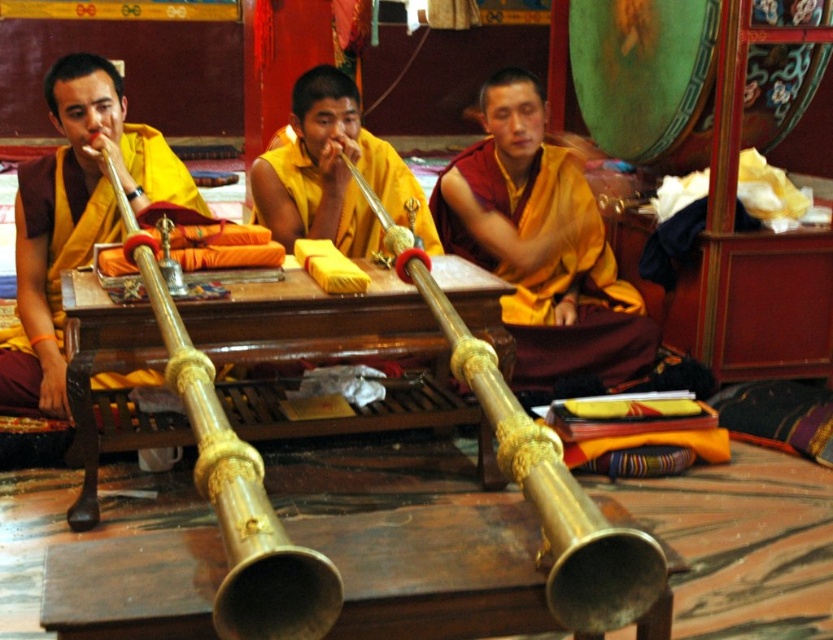
Question: Which of the following is the closest to the observer?

Choices:
 (A) yellow silk monk at center
 (B) gold polished horn at center
 (C) maroon silk robe at center
 (D) matte gold horn at left

Answer: (B)

Question: Can you confirm if matte gold horn at left is positioned to the right of gold polished trumpet at left?

Choices:
 (A) yes
 (B) no

Answer: (B)

Question: Is the position of gold polished trumpet at left less distant than that of yellow silk monk at center?

Choices:
 (A) yes
 (B) no

Answer: (A)

Question: Which object is closer to the camera taking this photo?

Choices:
 (A) yellow silk monk at center
 (B) maroon silk robe at center
 (C) gold polished horn at center

Answer: (C)

Question: Which of the following is the closest to the observer?

Choices:
 (A) gold polished horn at center
 (B) matte gold horn at left
 (C) maroon silk robe at center
 (D) yellow silk monk at center

Answer: (A)

Question: Is gold polished horn at center wider than yellow silk monk at center?

Choices:
 (A) no
 (B) yes

Answer: (A)